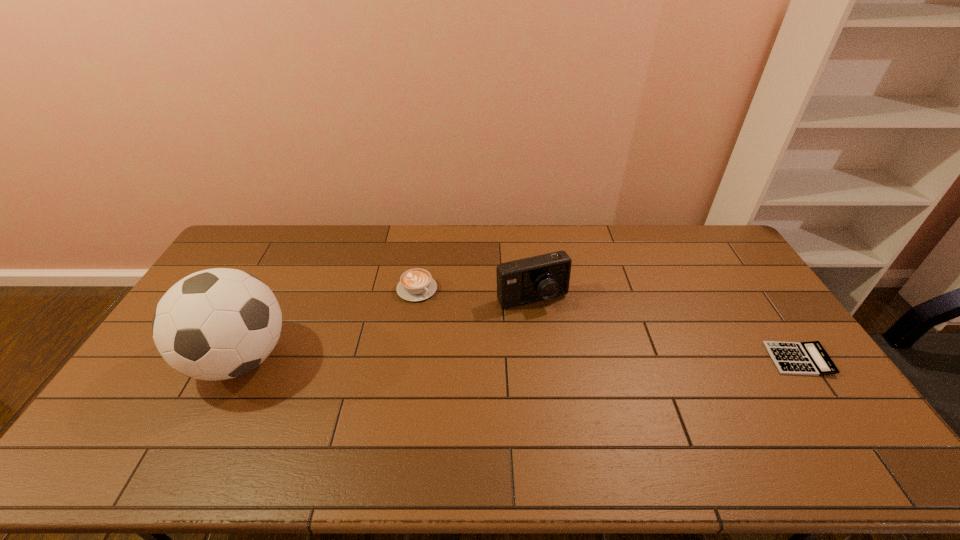
This screenshot has height=540, width=960. In order to click on the tallest object in this screenshot , I will do `click(216, 324)`.

Find the location of a particular element. soccer ball is located at coordinates (216, 324).

Locate an element on the screen. The width and height of the screenshot is (960, 540). the shortest object is located at coordinates (795, 358).

This screenshot has height=540, width=960. Identify the location of the rightmost object. (795, 358).

Locate an element on the screen. the third tallest object is located at coordinates (416, 284).

Locate an element on the screen. cappuccino is located at coordinates (416, 284).

In order to click on camera in this screenshot , I will do `click(542, 277)`.

The width and height of the screenshot is (960, 540). I want to click on the second object from right to left, so point(542,277).

This screenshot has width=960, height=540. Identify the location of free spot located on the right of the soccer ball. (381, 359).

Locate an element on the screen. vacant region located 0.260m on the left of the calculator is located at coordinates (682, 359).